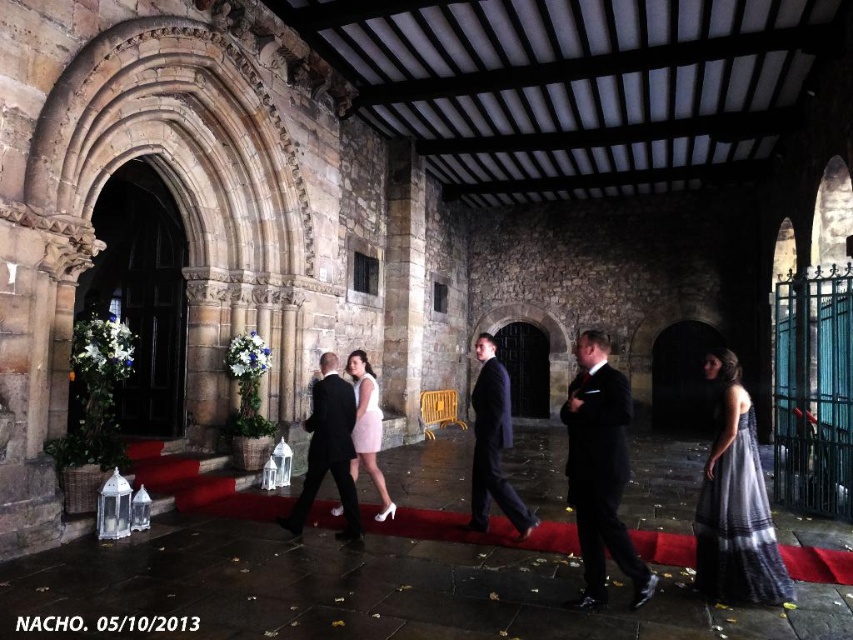
You are attending a formal event in this historic stone building. You notice two garments at the center of the room. Which garment is positioned lower in the room, the dark suit at center or the pale pink satin dress at center?

The dark suit at center is located below the pale pink satin dress at center, so the dark suit at center is positioned lower in the room.